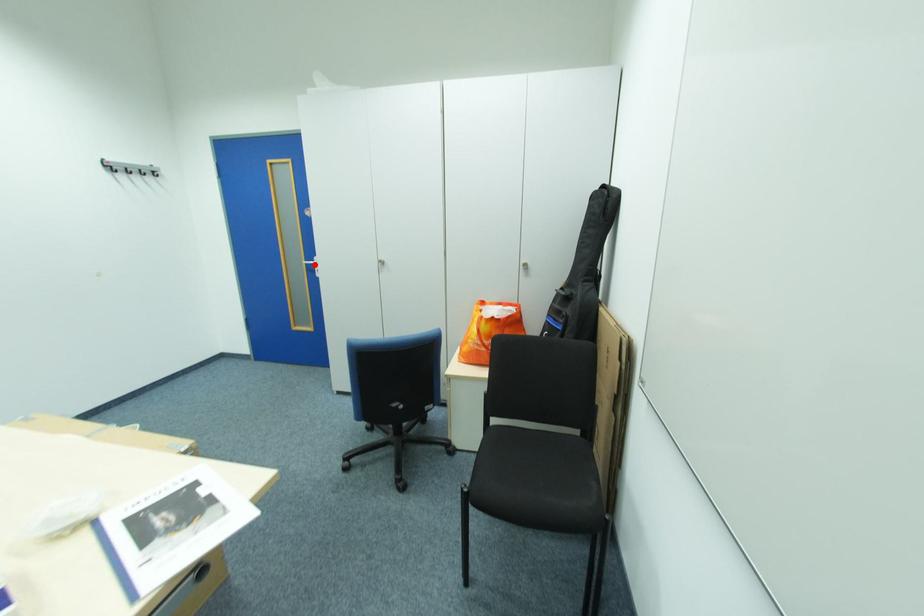
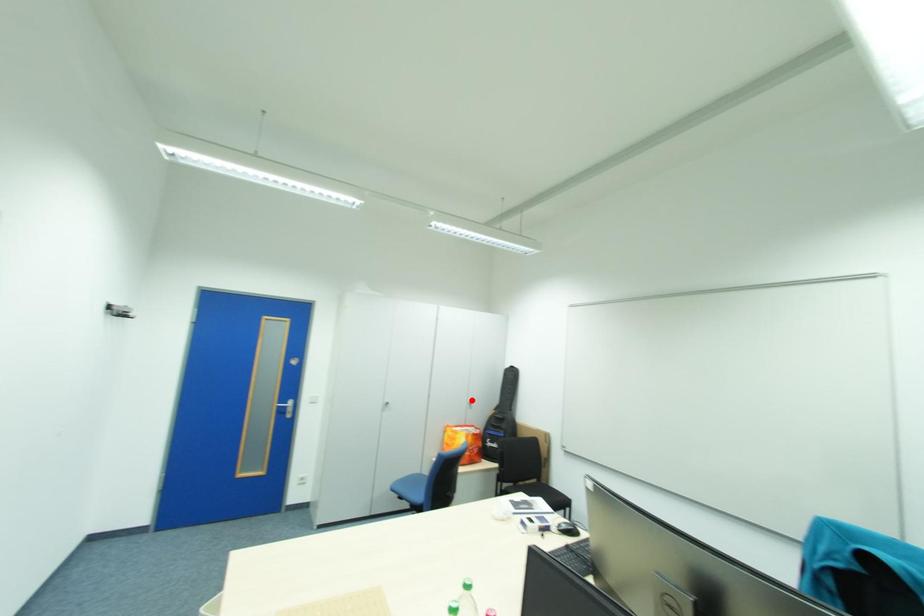
I am providing you with two images of the same scene from different viewpoints. A red point is marked on the first image and another point is marked on the second image. Is the red point in image1 aligned with the point shown in image2?

No